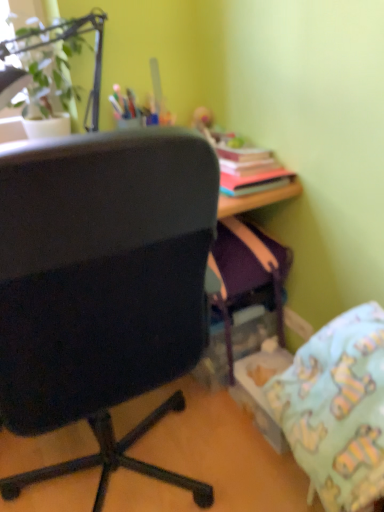
Question: Is black fabric chair at left smaller than light blue fabric pillow at lower right?

Choices:
 (A) yes
 (B) no

Answer: (B)

Question: Is the depth of black fabric chair at left less than that of light blue fabric pillow at lower right?

Choices:
 (A) yes
 (B) no

Answer: (A)

Question: Does black fabric chair at left appear on the left side of light blue fabric pillow at lower right?

Choices:
 (A) no
 (B) yes

Answer: (B)

Question: Does black fabric chair at left touch light blue fabric pillow at lower right?

Choices:
 (A) yes
 (B) no

Answer: (B)

Question: From a real-world perspective, is black fabric chair at left on top of light blue fabric pillow at lower right?

Choices:
 (A) yes
 (B) no

Answer: (A)

Question: In the image, is light blue fabric pillow at lower right positioned in front of or behind black fabric chair at left?

Choices:
 (A) front
 (B) behind

Answer: (B)

Question: Is light blue fabric pillow at lower right taller or shorter than black fabric chair at left?

Choices:
 (A) tall
 (B) short

Answer: (B)

Question: In terms of width, does light blue fabric pillow at lower right look wider or thinner when compared to black fabric chair at left?

Choices:
 (A) wide
 (B) thin

Answer: (B)

Question: From a real-world perspective, is light blue fabric pillow at lower right physically located above or below black fabric chair at left?

Choices:
 (A) above
 (B) below

Answer: (B)

Question: Is black fabric chair at left taller or shorter than light blue fabric pillow at lower right?

Choices:
 (A) short
 (B) tall

Answer: (B)

Question: Choose the correct answer: Is black fabric chair at left inside light blue fabric pillow at lower right or outside it?

Choices:
 (A) outside
 (B) inside

Answer: (A)

Question: In the image, is black fabric chair at left on the left side or the right side of light blue fabric pillow at lower right?

Choices:
 (A) right
 (B) left

Answer: (B)

Question: From the image's perspective, is black fabric chair at left positioned above or below light blue fabric pillow at lower right?

Choices:
 (A) below
 (B) above

Answer: (B)

Question: Is light blue fabric pillow at lower right to the left or to the right of green leafy plant at upper left in the image?

Choices:
 (A) left
 (B) right

Answer: (B)

Question: From the image's perspective, is light blue fabric pillow at lower right located above or below green leafy plant at upper left?

Choices:
 (A) below
 (B) above

Answer: (A)